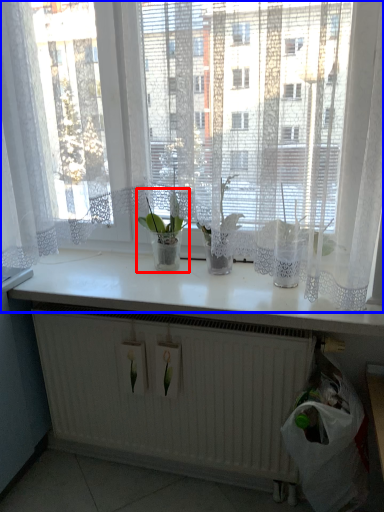
Question: Which point is closer to the camera, houseplant (highlighted by a red box) or curtain (highlighted by a blue box)?

Choices:
 (A) houseplant
 (B) curtain

Answer: (B)